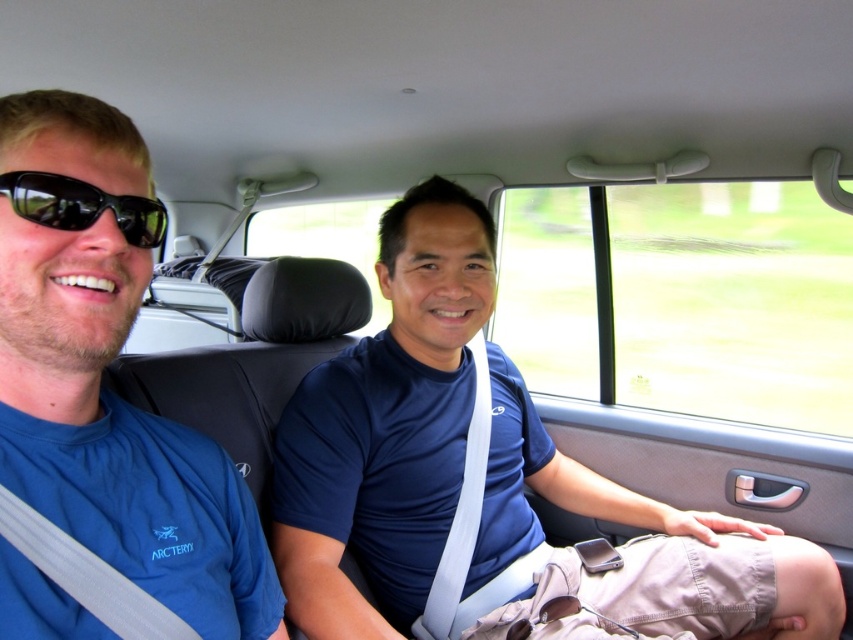
Question: Estimate the real-world distances between objects in this image. Which object is closer to the blue fabric shirt at center?

Choices:
 (A) blue fabric shirt at left
 (B) black plastic sunglasses at left

Answer: (A)

Question: Is blue fabric shirt at center smaller than blue fabric shirt at left?

Choices:
 (A) yes
 (B) no

Answer: (B)

Question: Is blue fabric shirt at left wider than black plastic sunglasses at left?

Choices:
 (A) no
 (B) yes

Answer: (B)

Question: Which point is closer to the camera?

Choices:
 (A) (80, 225)
 (B) (137, 422)
 (C) (335, 593)

Answer: (A)

Question: Estimate the real-world distances between objects in this image. Which object is closer to the black plastic sunglasses at left?

Choices:
 (A) blue fabric shirt at center
 (B) blue fabric shirt at left

Answer: (B)

Question: Is the position of blue fabric shirt at left less distant than that of black plastic sunglasses at left?

Choices:
 (A) yes
 (B) no

Answer: (A)